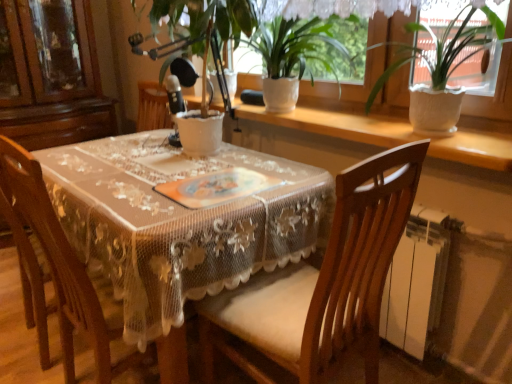
Question: From a real-world perspective, is wooden chair at center, the 1th chair from the left, below white ceramic pot at upper right, which is the 1th houseplant in right-to-left order?

Choices:
 (A) no
 (B) yes

Answer: (B)

Question: Would you say white ceramic pot at upper right, which ranks as the third houseplant in left-to-right order, is part of wooden chair at center, which is the second chair from right to left,'s contents?

Choices:
 (A) yes
 (B) no

Answer: (B)

Question: Is wooden chair at center, the 1th chair from the left, in front of white ceramic pot at upper right, which ranks as the third houseplant in left-to-right order?

Choices:
 (A) yes
 (B) no

Answer: (A)

Question: Is wooden chair at center, which is the second chair from right to left, positioned behind white ceramic pot at upper right, which ranks as the third houseplant in left-to-right order?

Choices:
 (A) no
 (B) yes

Answer: (A)

Question: Is wooden chair at center, the 1th chair from the left, facing away from white ceramic pot at upper right, which is the 1th houseplant in right-to-left order?

Choices:
 (A) yes
 (B) no

Answer: (B)

Question: From a real-world perspective, relative to white ceramic pot at center, the first houseplant from the left, is wooden chair at center, the 1th chair from the left, vertically above or below?

Choices:
 (A) above
 (B) below

Answer: (B)

Question: In the image, is wooden chair at center, the 1th chair from the left, on the left side or the right side of white ceramic pot at center, which is the third houseplant in right-to-left order?

Choices:
 (A) left
 (B) right

Answer: (A)

Question: Considering the positions of point (8, 175) and point (232, 14), is point (8, 175) closer or farther from the camera than point (232, 14)?

Choices:
 (A) closer
 (B) farther

Answer: (A)

Question: Is wooden chair at center, the 1th chair from the left, taller or shorter than white ceramic pot at center, the first houseplant from the left?

Choices:
 (A) short
 (B) tall

Answer: (B)

Question: From the image's perspective, is wooden chair at center, the 1th chair from the left, positioned above or below white ceramic pot at upper right, which is the 1th houseplant in right-to-left order?

Choices:
 (A) below
 (B) above

Answer: (A)

Question: Considering the positions of wooden chair at center, which is the second chair from right to left, and white ceramic pot at upper right, which ranks as the third houseplant in left-to-right order, in the image, is wooden chair at center, which is the second chair from right to left, taller or shorter than white ceramic pot at upper right, which ranks as the third houseplant in left-to-right order,?

Choices:
 (A) tall
 (B) short

Answer: (A)

Question: Does point (36, 215) appear closer or farther from the camera than point (440, 91)?

Choices:
 (A) farther
 (B) closer

Answer: (B)

Question: Choose the correct answer: Is wooden chair at center, the 1th chair from the left, inside white ceramic pot at upper right, which ranks as the third houseplant in left-to-right order, or outside it?

Choices:
 (A) inside
 (B) outside

Answer: (B)

Question: Looking at their shapes, would you say white ceramic pot at upper right, which is the 1th houseplant in right-to-left order, is wider or thinner than white textured window sill at upper center?

Choices:
 (A) thin
 (B) wide

Answer: (A)

Question: Choose the correct answer: Is white ceramic pot at upper right, which ranks as the third houseplant in left-to-right order, inside white textured window sill at upper center or outside it?

Choices:
 (A) outside
 (B) inside

Answer: (A)